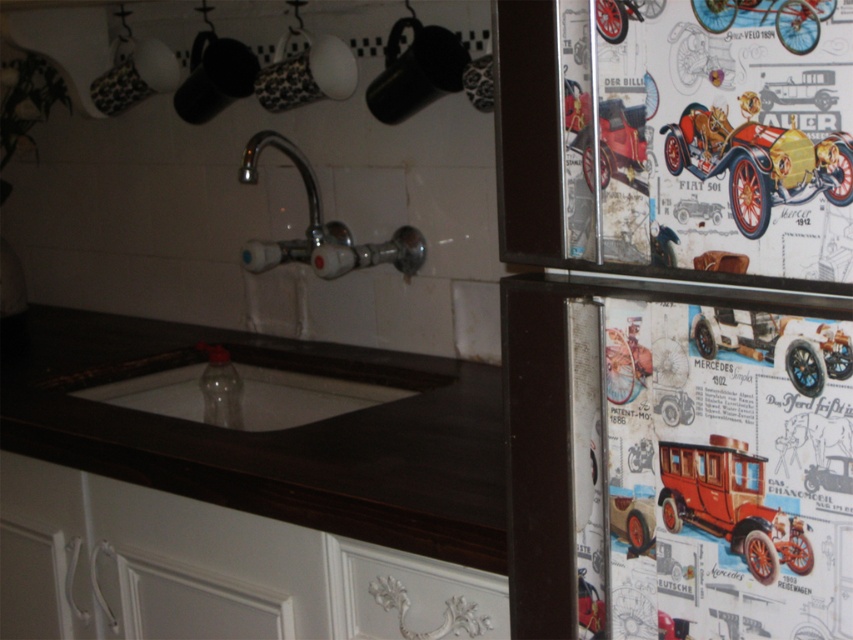
Question: Is white glossy sink at center to the left of vintage cardboard car at right from the viewer's perspective?

Choices:
 (A) yes
 (B) no

Answer: (A)

Question: Among these points, which one is farthest from the camera?

Choices:
 (A) (791, 330)
 (B) (408, 253)

Answer: (B)

Question: Is metallic vintage car at upper right to the left of white glossy sink at center from the viewer's perspective?

Choices:
 (A) yes
 (B) no

Answer: (B)

Question: Which of the following is the farthest from the observer?

Choices:
 (A) white glossy sink at center
 (B) metallic bicycle at upper right
 (C) vintage cardboard car at right
 (D) dark wood countertop at center

Answer: (A)

Question: Which is farther from the vintage cardboard car at right?

Choices:
 (A) metallic bicycle at upper right
 (B) metallic silver car at upper right
 (C) chrome/polished metal faucet at upper center

Answer: (C)

Question: Can you confirm if chrome/polished metal faucet at upper center is positioned to the right of metallic silver car at upper right?

Choices:
 (A) no
 (B) yes

Answer: (A)